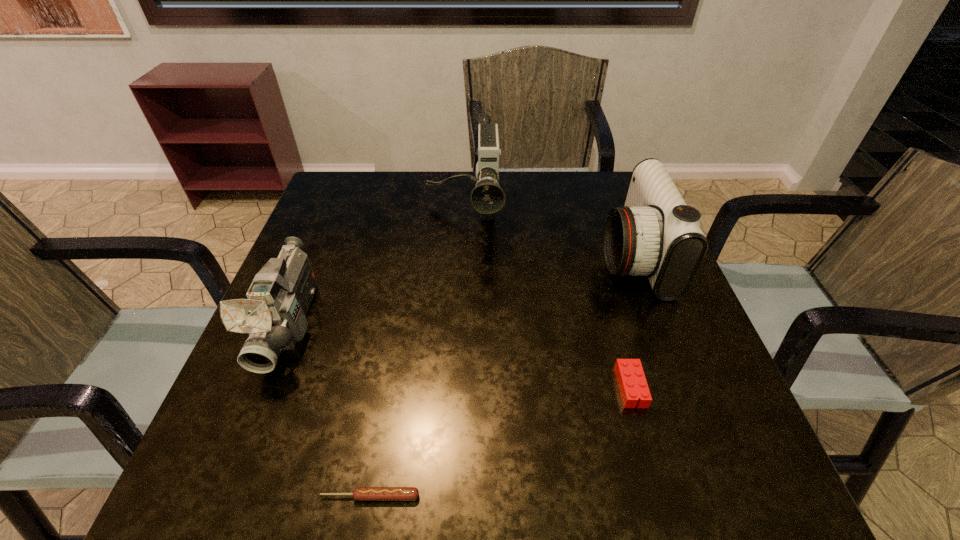
This screenshot has width=960, height=540. In order to click on vacant space at the left edge in this screenshot , I will do `click(346, 280)`.

Locate an element on the screen. This screenshot has width=960, height=540. vacant region at the right edge is located at coordinates tap(596, 227).

The height and width of the screenshot is (540, 960). Identify the location of vacant space at the far right corner. (595, 181).

The image size is (960, 540). I want to click on vacant space that is in between the nearest object and the rightmost camcorder, so click(501, 376).

The width and height of the screenshot is (960, 540). I want to click on empty location between the second shortest object and the second camcorder from right to left, so click(x=546, y=302).

You are a GUI agent. You are given a task and a screenshot of the screen. Output one action in this format:
    pyautogui.click(x=<x>, y=<y>)
    Task: Click on the empty space that is in between the second shortest object and the shortest object
    This screenshot has height=540, width=960.
    Given the screenshot: What is the action you would take?
    pyautogui.click(x=500, y=442)

This screenshot has width=960, height=540. Find the location of `vacant area that lies between the rightmost camcorder and the nearest object`. vacant area that lies between the rightmost camcorder and the nearest object is located at coordinates pyautogui.click(x=501, y=376).

This screenshot has height=540, width=960. In order to click on empty location between the Lego and the nearest object in this screenshot , I will do `click(500, 442)`.

Find the location of a particular element. The image size is (960, 540). blank region between the nearest object and the leftmost camcorder is located at coordinates (330, 410).

At what (x,y) coordinates should I click in order to perform the action: click on free space between the second shortest object and the rightmost camcorder. Please return your answer as a coordinate pair (x, y). Looking at the image, I should click on (632, 321).